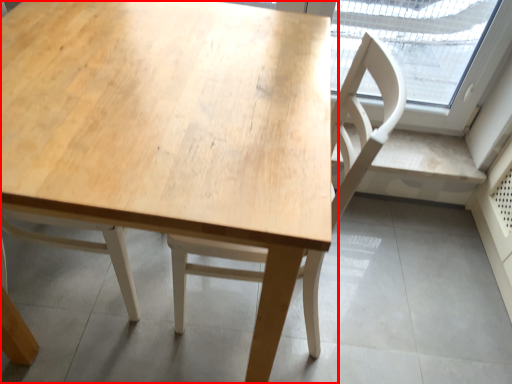
Question: In this image, where is table (annotated by the red box) located relative to chair?

Choices:
 (A) right
 (B) left

Answer: (B)